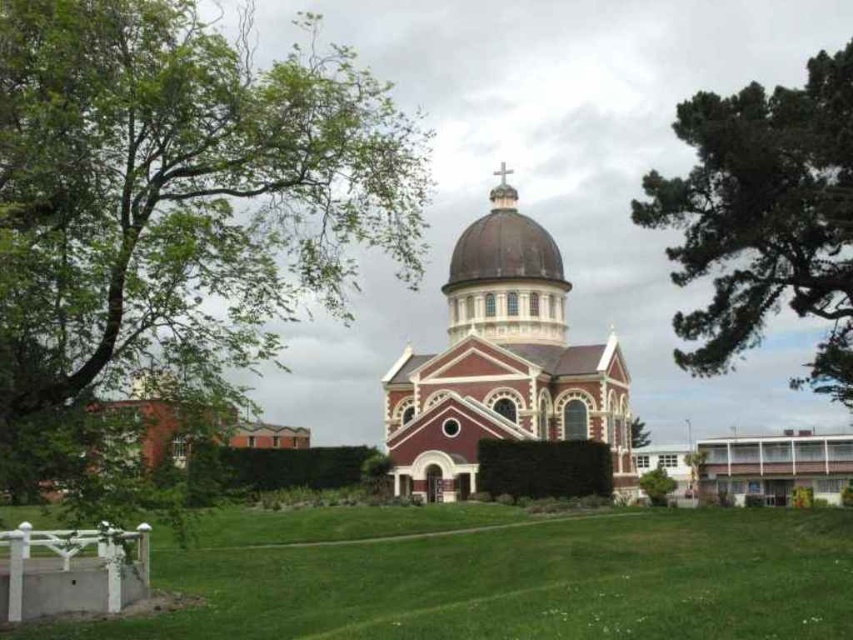
You are standing in front of the church and want to take a photo that includes both the smooth gold dome at center and the green leafy tree at center. The camera you have can capture objects up to 100 feet apart. Will both objects fit in the same photo?

The smooth gold dome at center is 108.18 feet away from the green leafy tree at center, which exceeds the camera range of 100 feet. Therefore, both objects cannot fit in the same photo.